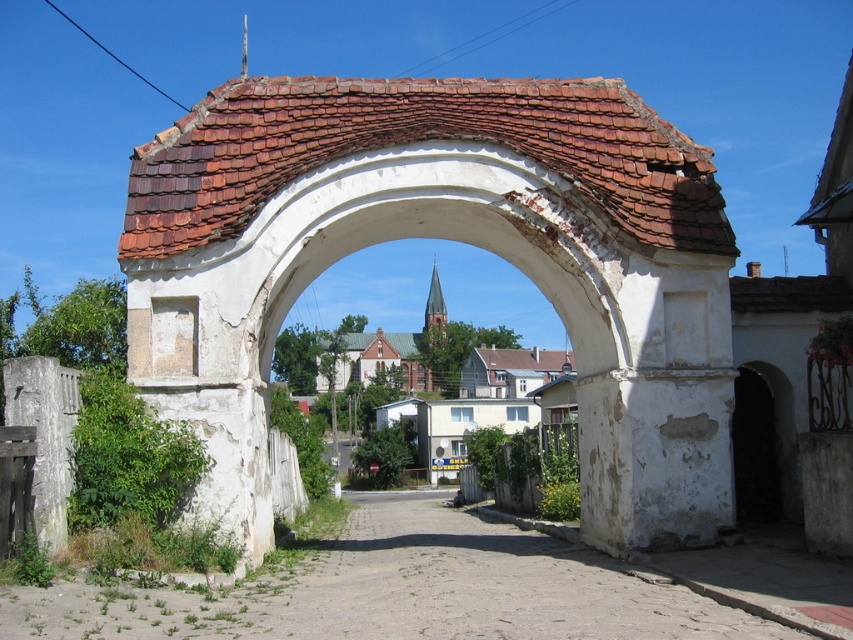
Is brown brick church at center wider than gray concrete gate at left?

Indeed, brown brick church at center has a greater width compared to gray concrete gate at left.

Is brown brick church at center taller than gray concrete gate at left?

Correct, brown brick church at center is much taller as gray concrete gate at left.

The image size is (853, 640). What do you see at coordinates (450, 356) in the screenshot?
I see `brown brick church at center` at bounding box center [450, 356].

The image size is (853, 640). I want to click on brown brick church at center, so tap(450, 356).

Between dirt road at center and gray concrete gate at left, which one has less height?

gray concrete gate at left

Which is more to the right, dirt road at center or gray concrete gate at left?

Positioned to the right is dirt road at center.

Is point (543, 608) closer to viewer compared to point (67, 476)?

Yes, it is in front of point (67, 476).

This screenshot has width=853, height=640. In order to click on dirt road at center in this screenshot , I will do `click(401, 592)`.

Does point (502, 561) come behind point (350, 348)?

No.

Does dirt road at center have a smaller size compared to brown brick church at center?

Yes, dirt road at center is smaller than brown brick church at center.

This screenshot has height=640, width=853. Describe the element at coordinates (401, 592) in the screenshot. I see `dirt road at center` at that location.

Image resolution: width=853 pixels, height=640 pixels. I want to click on dirt road at center, so click(401, 592).